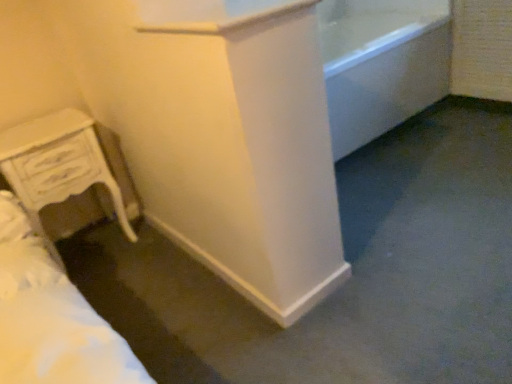
Question: From the image's perspective, does white glossy bathtub at upper right appear higher than white wood chest of drawers at lower left?

Choices:
 (A) no
 (B) yes

Answer: (B)

Question: Is white glossy bathtub at upper right smaller than white wood chest of drawers at lower left?

Choices:
 (A) no
 (B) yes

Answer: (A)

Question: Does white glossy bathtub at upper right have a greater width compared to white wood chest of drawers at lower left?

Choices:
 (A) no
 (B) yes

Answer: (B)

Question: Does white glossy bathtub at upper right appear on the right side of white wood chest of drawers at lower left?

Choices:
 (A) no
 (B) yes

Answer: (B)

Question: From the image's perspective, is white glossy bathtub at upper right beneath white wood chest of drawers at lower left?

Choices:
 (A) yes
 (B) no

Answer: (B)

Question: Could you tell me if white glossy bathtub at upper right is turned towards white wood chest of drawers at lower left?

Choices:
 (A) yes
 (B) no

Answer: (B)

Question: Is white wood chest of drawers at lower left smaller than white glossy bathtub at upper right?

Choices:
 (A) no
 (B) yes

Answer: (B)

Question: Is white wood chest of drawers at lower left in contact with white glossy bathtub at upper right?

Choices:
 (A) yes
 (B) no

Answer: (B)

Question: Can you confirm if white wood chest of drawers at lower left is bigger than white glossy bathtub at upper right?

Choices:
 (A) no
 (B) yes

Answer: (A)

Question: Is white wood chest of drawers at lower left far away from white glossy bathtub at upper right?

Choices:
 (A) no
 (B) yes

Answer: (B)

Question: Is the depth of white wood chest of drawers at lower left greater than that of white glossy bathtub at upper right?

Choices:
 (A) no
 (B) yes

Answer: (A)

Question: From a real-world perspective, does white wood chest of drawers at lower left stand above white glossy bathtub at upper right?

Choices:
 (A) no
 (B) yes

Answer: (B)

Question: From the image's perspective, is white glossy bathtub at upper right above or below white wood chest of drawers at lower left?

Choices:
 (A) below
 (B) above

Answer: (B)